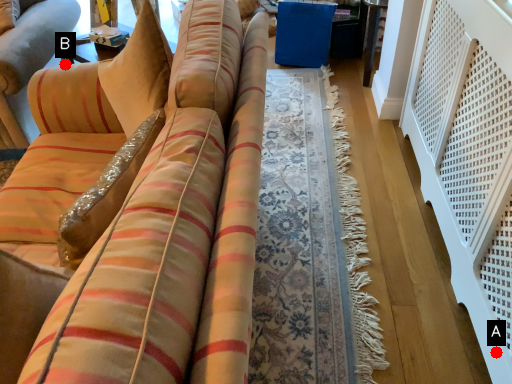
Question: Two points are circled on the image, labeled by A and B beside each circle. Which point is farther from the camera taking this photo?

Choices:
 (A) A is further
 (B) B is further

Answer: (B)